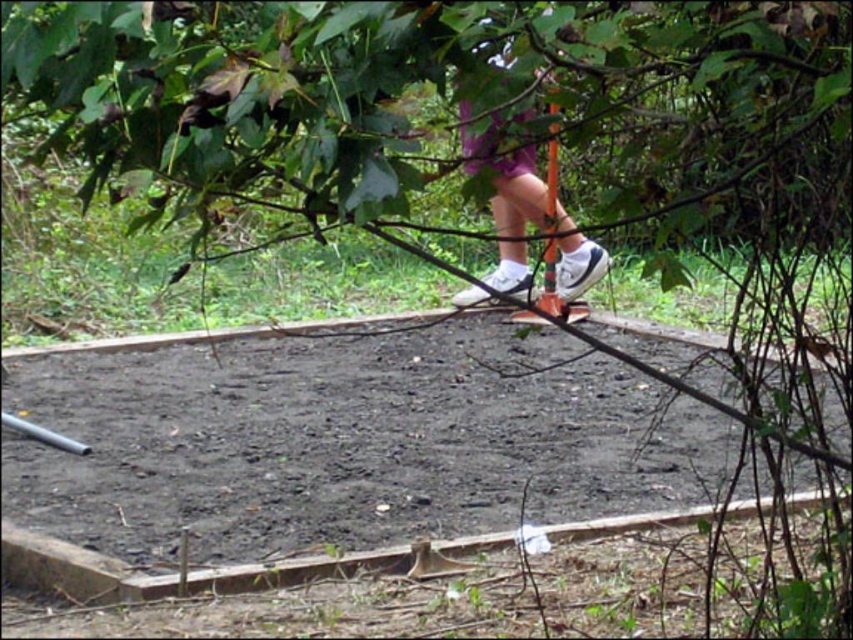
Question: Considering the relative positions of dark brown soil at center and purple fabric shorts at center in the image provided, where is dark brown soil at center located with respect to purple fabric shorts at center?

Choices:
 (A) above
 (B) below

Answer: (B)

Question: Among these objects, which one is nearest to the camera?

Choices:
 (A) dark brown soil at center
 (B) purple fabric shorts at center

Answer: (A)

Question: Considering the relative positions of dark brown soil at center and purple fabric shorts at center in the image provided, where is dark brown soil at center located with respect to purple fabric shorts at center?

Choices:
 (A) below
 (B) above

Answer: (A)

Question: Among these points, which one is farthest from the camera?

Choices:
 (A) (633, 417)
 (B) (489, 276)

Answer: (B)

Question: Where is dark brown soil at center located in relation to purple fabric shorts at center in the image?

Choices:
 (A) above
 (B) below

Answer: (B)